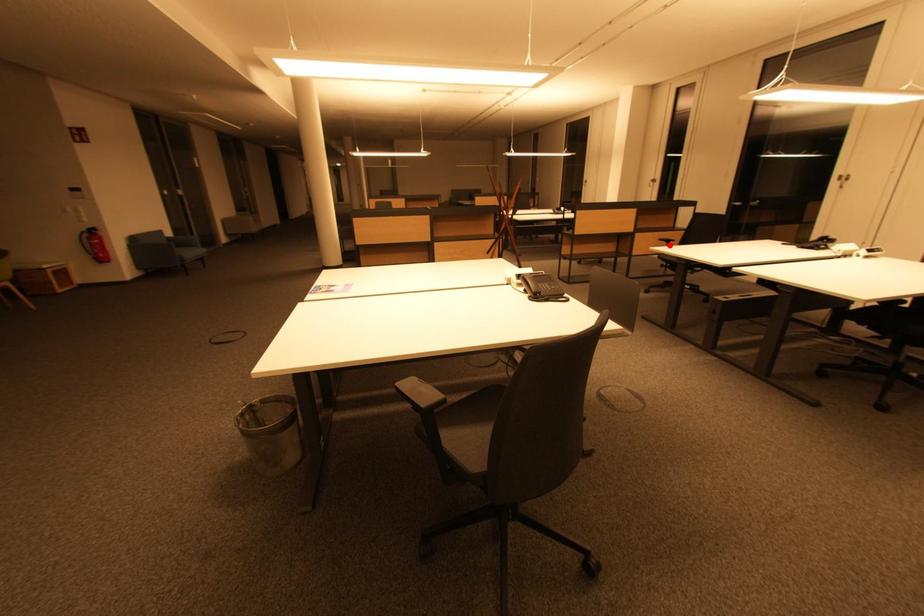
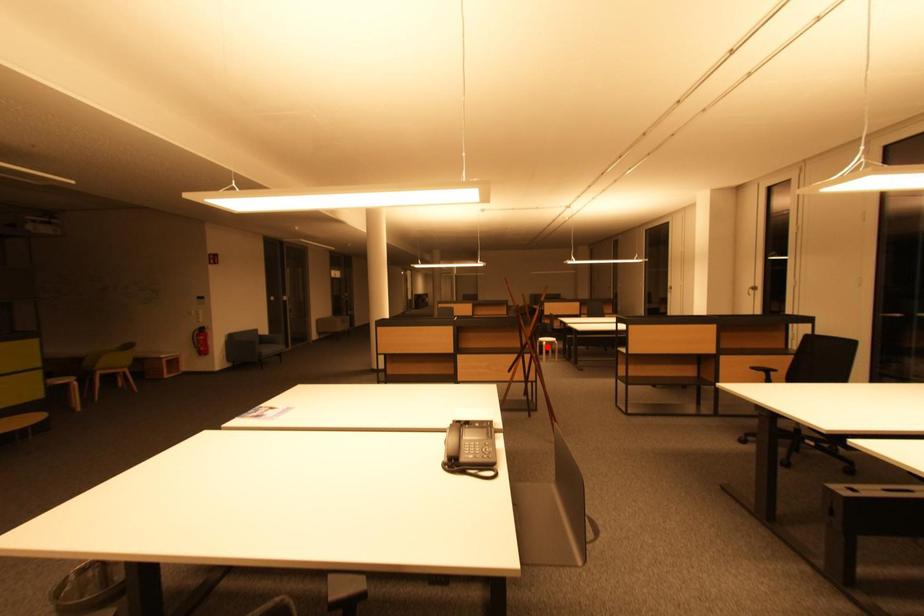
I am providing you with two images of the same scene from different viewpoints. A red point is marked on the first image and another point is marked on the second image. Is the marked point in image1 the same physical position as the marked point in image2?

No